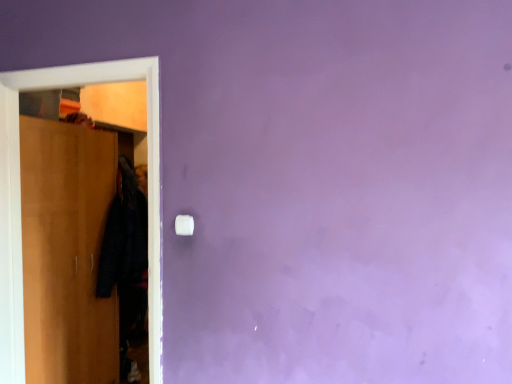
Describe the element at coordinates (184, 225) in the screenshot. The width and height of the screenshot is (512, 384). I see `white plastic light switch at center` at that location.

Identify the location of wooden wardrobe at left. (66, 252).

Locate an element on the screen. black fabric coat at left is located at coordinates (126, 252).

From a real-world perspective, is white plastic light switch at center under black fabric coat at left?

No, from a real-world perspective, white plastic light switch at center is not under black fabric coat at left.

Would you say white plastic light switch at center is outside black fabric coat at left?

Yes, white plastic light switch at center is not within black fabric coat at left.

Is white plastic light switch at center bigger or smaller than black fabric coat at left?

white plastic light switch at center is smaller than black fabric coat at left.

How many degrees apart are the facing directions of white plastic light switch at center and black fabric coat at left?

They differ by 94.8 degrees in their facing directions.

What's the angular difference between wooden wardrobe at left and black fabric coat at left's facing directions?

The angle between the facing direction of wooden wardrobe at left and the facing direction of black fabric coat at left is 5.15 degrees.

From a real-world perspective, is wooden wardrobe at left on top of black fabric coat at left?

Incorrect, from a real-world perspective, wooden wardrobe at left is lower than black fabric coat at left.

Looking at their sizes, would you say wooden wardrobe at left is wider or thinner than black fabric coat at left?

Clearly, wooden wardrobe at left has more width compared to black fabric coat at left.

How far apart are black fabric coat at left and white plastic light switch at center?

black fabric coat at left is 1.35 meters from white plastic light switch at center.

Relative to white plastic light switch at center, is black fabric coat at left in front or behind?

Clearly, black fabric coat at left is behind white plastic light switch at center.

Can you confirm if black fabric coat at left is thinner than white plastic light switch at center?

Incorrect, the width of black fabric coat at left is not less than that of white plastic light switch at center.

From the image's perspective, is black fabric coat at left on top of white plastic light switch at center?

No, from the image's perspective, black fabric coat at left is not on top of white plastic light switch at center.

Who is smaller, wooden wardrobe at left or white plastic light switch at center?

white plastic light switch at center is smaller.

Is wooden wardrobe at left facing away from white plastic light switch at center?

wooden wardrobe at left is not turned away from white plastic light switch at center.

From the image's perspective, is wooden wardrobe at left below white plastic light switch at center?

Yes, from the image's perspective, wooden wardrobe at left is beneath white plastic light switch at center.

Can you confirm if wooden wardrobe at left is positioned to the right of white plastic light switch at center?

No, wooden wardrobe at left is not to the right of white plastic light switch at center.

Is white plastic light switch at center next to wooden wardrobe at left?

No, white plastic light switch at center is not beside wooden wardrobe at left.

Considering the relative sizes of white plastic light switch at center and wooden wardrobe at left in the image provided, is white plastic light switch at center smaller than wooden wardrobe at left?

Indeed, white plastic light switch at center has a smaller size compared to wooden wardrobe at left.

Considering the positions of objects white plastic light switch at center and wooden wardrobe at left in the image provided, who is more to the left, white plastic light switch at center or wooden wardrobe at left?

wooden wardrobe at left is more to the left.

Is wooden wardrobe at left at the back of black fabric coat at left?

Absolutely, black fabric coat at left is directed away from wooden wardrobe at left.

From a real-world perspective, is black fabric coat at left positioned over wooden wardrobe at left based on gravity?

Indeed, from a real-world perspective, black fabric coat at left stands above wooden wardrobe at left.

Which is in front, point (108, 265) or point (94, 307)?

The point (94, 307) is more forward.

Find the location of `light switch located above the black fabric coat at left (from the image's perspective)`. light switch located above the black fabric coat at left (from the image's perspective) is located at coordinates (184, 225).

Find the location of a particular element. The image size is (512, 384). clothing that appears behind the wooden wardrobe at left is located at coordinates (126, 252).

Estimate the real-world distances between objects in this image. Which object is further from white plastic light switch at center, black fabric coat at left or wooden wardrobe at left?

The object further to white plastic light switch at center is black fabric coat at left.

Looking at the image, which one is located further to white plastic light switch at center, wooden wardrobe at left or black fabric coat at left?

Based on the image, black fabric coat at left appears to be further to white plastic light switch at center.

Which object lies further to the anchor point wooden wardrobe at left, white plastic light switch at center or black fabric coat at left?

Among the two, white plastic light switch at center is located further to wooden wardrobe at left.

When comparing their distances from wooden wardrobe at left, does black fabric coat at left or white plastic light switch at center seem further?

The object further to wooden wardrobe at left is white plastic light switch at center.

Which object lies nearer to the anchor point black fabric coat at left, white plastic light switch at center or wooden wardrobe at left?

Based on the image, wooden wardrobe at left appears to be nearer to black fabric coat at left.

Considering their positions, is wooden wardrobe at left positioned further to black fabric coat at left than white plastic light switch at center?

white plastic light switch at center is positioned further to the anchor black fabric coat at left.

Where is `clothing located between wooden wardrobe at left and white plastic light switch at center in the left-right direction`? The width and height of the screenshot is (512, 384). clothing located between wooden wardrobe at left and white plastic light switch at center in the left-right direction is located at coordinates (126, 252).